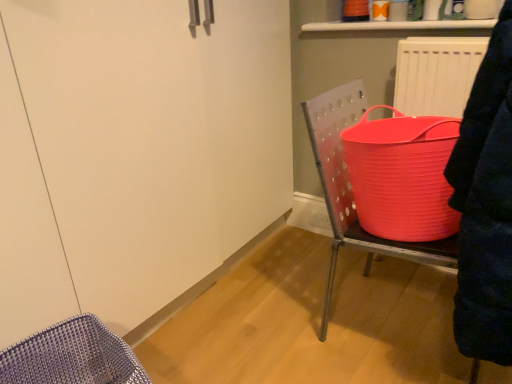
Find the location of a particular element. This screenshot has width=512, height=384. matte white radiator at upper right is located at coordinates (436, 74).

The width and height of the screenshot is (512, 384). Describe the element at coordinates (436, 74) in the screenshot. I see `matte white radiator at upper right` at that location.

The height and width of the screenshot is (384, 512). Describe the element at coordinates (351, 188) in the screenshot. I see `rubberized plastic bucket at right` at that location.

Where is `rubberized plastic bucket at right`? rubberized plastic bucket at right is located at coordinates (351, 188).

Image resolution: width=512 pixels, height=384 pixels. Identify the location of matte white radiator at upper right. (436, 74).

Can you confirm if matte white radiator at upper right is positioned to the left of rubberized plastic bucket at right?

In fact, matte white radiator at upper right is to the right of rubberized plastic bucket at right.

Considering their positions, is matte white radiator at upper right located in front of or behind rubberized plastic bucket at right?

Visually, matte white radiator at upper right is located behind rubberized plastic bucket at right.

Is point (411, 55) closer or farther from the camera than point (309, 125)?

Point (411, 55) is farther from the camera than point (309, 125).

From the image's perspective, does matte white radiator at upper right appear lower than rubberized plastic bucket at right?

Actually, matte white radiator at upper right appears above rubberized plastic bucket at right in the image.

From a real-world perspective, is matte white radiator at upper right above or below rubberized plastic bucket at right?

matte white radiator at upper right is above rubberized plastic bucket at right.

Which of these two, matte white radiator at upper right or rubberized plastic bucket at right, is thinner?

matte white radiator at upper right.

Does matte white radiator at upper right have a greater height compared to rubberized plastic bucket at right?

Incorrect, the height of matte white radiator at upper right is not larger of that of rubberized plastic bucket at right.

Does matte white radiator at upper right have a larger size compared to rubberized plastic bucket at right?

Actually, matte white radiator at upper right might be smaller than rubberized plastic bucket at right.

Is matte white radiator at upper right inside or outside of rubberized plastic bucket at right?

matte white radiator at upper right is spatially situated outside rubberized plastic bucket at right.

Is matte white radiator at upper right placed right next to rubberized plastic bucket at right?

matte white radiator at upper right and rubberized plastic bucket at right are not in contact.

Is matte white radiator at upper right oriented towards rubberized plastic bucket at right?

Yes, matte white radiator at upper right is facing rubberized plastic bucket at right.

Locate an element on the screen. radiator on the right of rubberized plastic bucket at right is located at coordinates (436, 74).

Which object is positioned more to the right, rubberized plastic bucket at right or matte white radiator at upper right?

matte white radiator at upper right.

Is rubberized plastic bucket at right closer to the viewer compared to matte white radiator at upper right?

Yes, rubberized plastic bucket at right is closer to the viewer.

Which is in front, point (332, 138) or point (472, 45)?

Positioned in front is point (332, 138).

From the image's perspective, which is below, rubberized plastic bucket at right or matte white radiator at upper right?

rubberized plastic bucket at right.

From a real-world perspective, is rubberized plastic bucket at right physically located above or below matte white radiator at upper right?

rubberized plastic bucket at right is below matte white radiator at upper right.

Which of these two, rubberized plastic bucket at right or matte white radiator at upper right, is thinner?

matte white radiator at upper right is thinner.

Looking at this image, can you confirm if rubberized plastic bucket at right is taller than matte white radiator at upper right?

Indeed, rubberized plastic bucket at right has a greater height compared to matte white radiator at upper right.

Based on the photo, who is bigger, rubberized plastic bucket at right or matte white radiator at upper right?

rubberized plastic bucket at right.

Is rubberized plastic bucket at right inside or outside of matte white radiator at upper right?

rubberized plastic bucket at right is outside matte white radiator at upper right.

Would you say rubberized plastic bucket at right is a long distance from matte white radiator at upper right?

They are positioned close to each other.

Is rubberized plastic bucket at right oriented away from matte white radiator at upper right?

Yes, rubberized plastic bucket at right's orientation is away from matte white radiator at upper right.

You are a GUI agent. You are given a task and a screenshot of the screen. Output one action in this format:
    pyautogui.click(x=<x>, y=<y>)
    Task: Click on the furniture directly beneath the matte white radiator at upper right (from a real-world perspective)
    
    Given the screenshot: What is the action you would take?
    pyautogui.click(x=351, y=188)

Image resolution: width=512 pixels, height=384 pixels. What are the coordinates of `radiator behind the rubberized plastic bucket at right` in the screenshot? It's located at click(x=436, y=74).

Where is `radiator above the rubberized plastic bucket at right (from the image's perspective)`? radiator above the rubberized plastic bucket at right (from the image's perspective) is located at coordinates (436, 74).